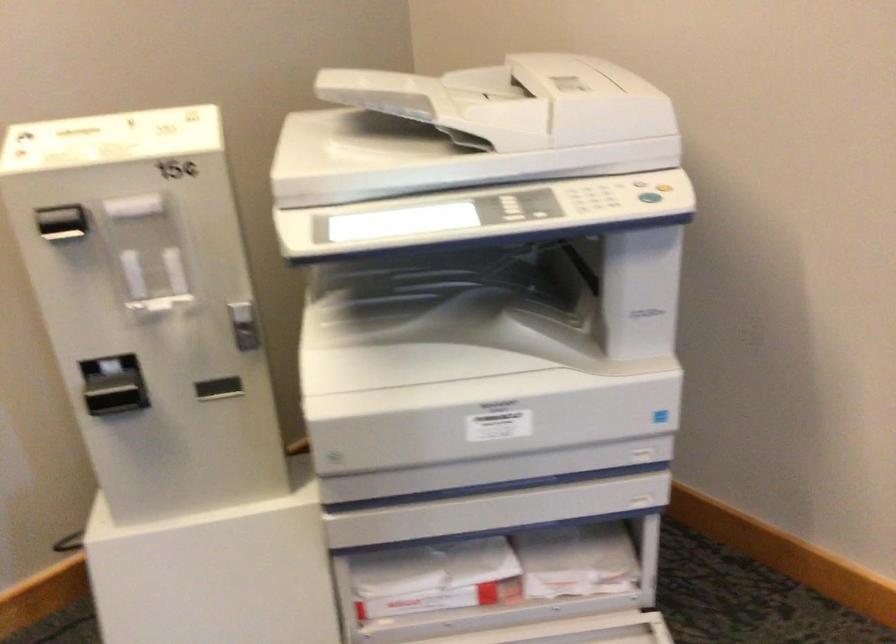
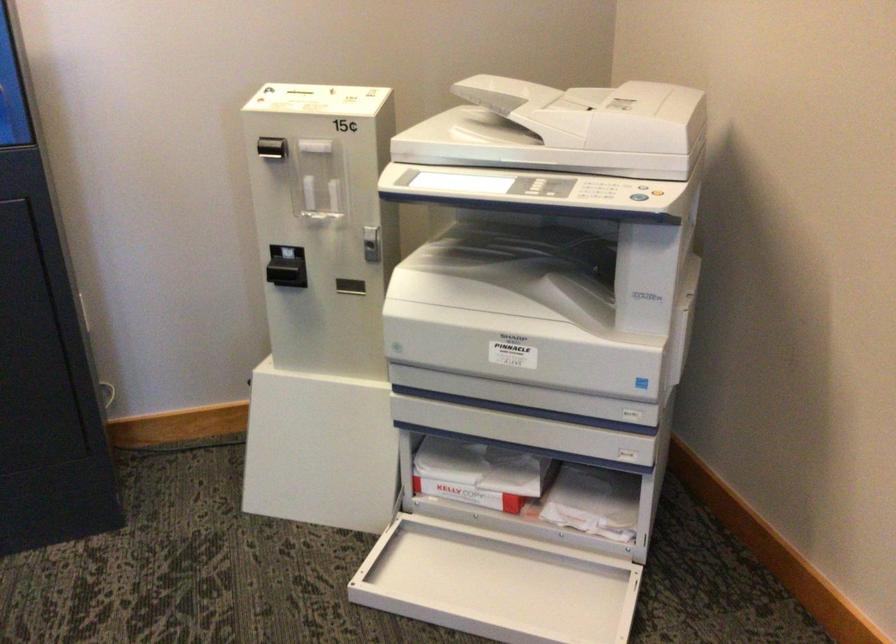
Where in the second image is the point corresponding to point (513, 565) from the first image?

(531, 488)